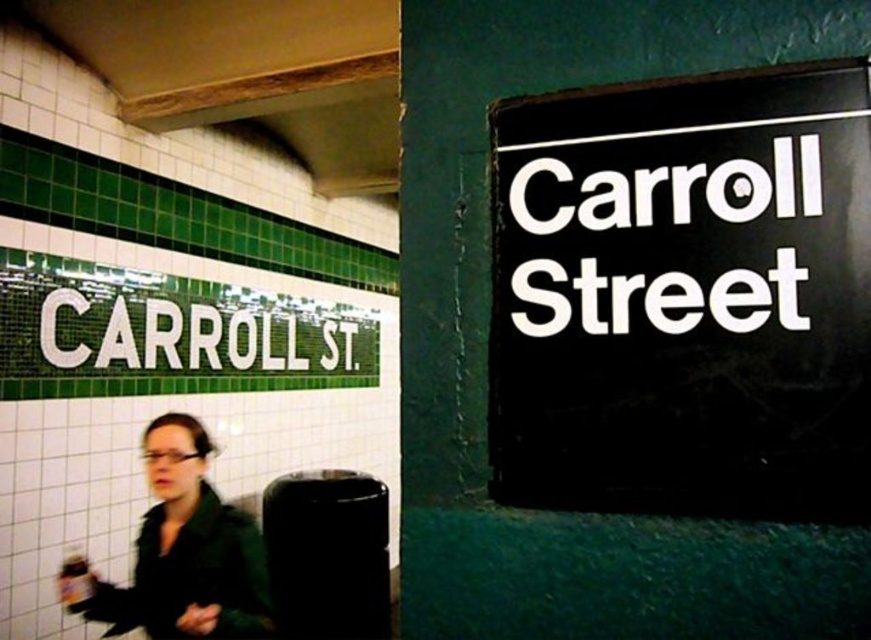
You are standing at the subway station and want to move from the point at coordinates point (842, 388) to the point at coordinates point (156, 428). Which direction should you move to get closer to your destination?

To move from point (842, 388) to point (156, 428), you should move downward and to the right because point (842, 388) is in front of point (156, 428), indicating that the destination is behind and to the left relative to your starting position.

You are standing at the subway station at Carroll Street and need to find the black plastic sign at upper right. According to the scene description, where should you look relative to the green and white tiled wall with the station name?

The black plastic sign at upper right is located at point (684, 294), which is to the upper right of the green and white tiled wall with the station name CARROLL ST.

You are a commuter waiting at the Carroll Street subway station. You notice a black plastic sign at upper right and a green matte jacket at lower left. Which object is larger in size?

The black plastic sign at upper right is smaller than the green matte jacket at lower left, so the green matte jacket at lower left is larger in size.